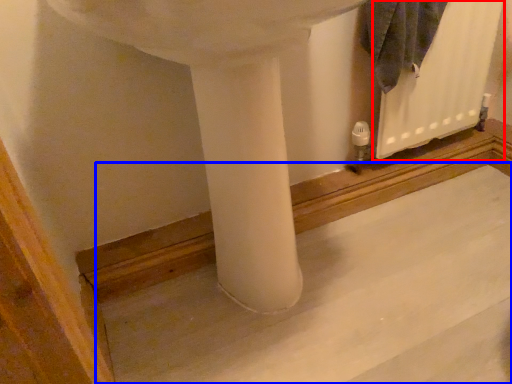
Question: Which of the following is the farthest to the observer, radiator (highlighted by a red box) or concrete (highlighted by a blue box)?

Choices:
 (A) radiator
 (B) concrete

Answer: (A)